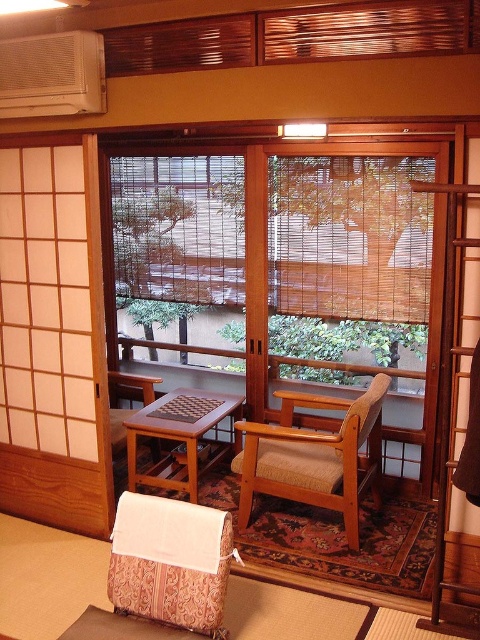
Does white plastic air conditioner at upper left appear on the right side of wooden armchair at left?

In fact, white plastic air conditioner at upper left is to the left of wooden armchair at left.

This screenshot has height=640, width=480. What do you see at coordinates (52, 74) in the screenshot? I see `white plastic air conditioner at upper left` at bounding box center [52, 74].

Locate an element on the screen. The width and height of the screenshot is (480, 640). white plastic air conditioner at upper left is located at coordinates (52, 74).

Where is `white plastic air conditioner at upper left`? white plastic air conditioner at upper left is located at coordinates pos(52,74).

Who is positioned more to the right, wooden woven armchair at center or wooden armchair at left?

wooden woven armchair at center is more to the right.

Is wooden woven armchair at center taller than wooden armchair at left?

Yes, wooden woven armchair at center is taller than wooden armchair at left.

This screenshot has height=640, width=480. Identify the location of wooden woven armchair at center. (313, 456).

How distant is wooden woven armchair at center from woodenobject at center?

wooden woven armchair at center is 20.66 inches away from woodenobject at center.

Which is above, wooden woven armchair at center or woodenobject at center?

Answer: Positioned higher is woodenobject at center.

Between point (244, 490) and point (160, 408), which one is positioned behind?

Positioned behind is point (160, 408).

At what (x,y) coordinates should I click in order to perform the action: click on wooden woven armchair at center. Please return your answer as a coordinate pair (x, y). The height and width of the screenshot is (640, 480). Looking at the image, I should click on (x=313, y=456).